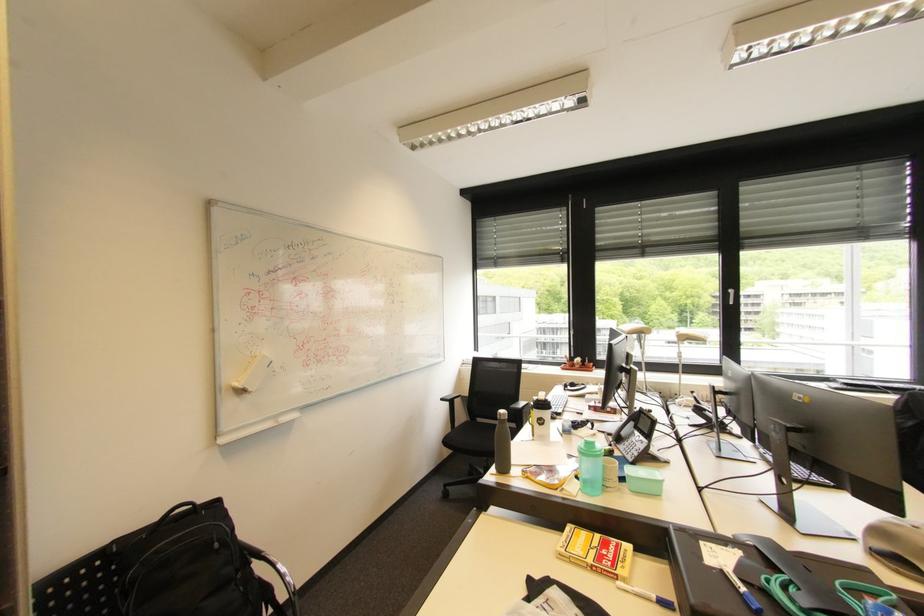
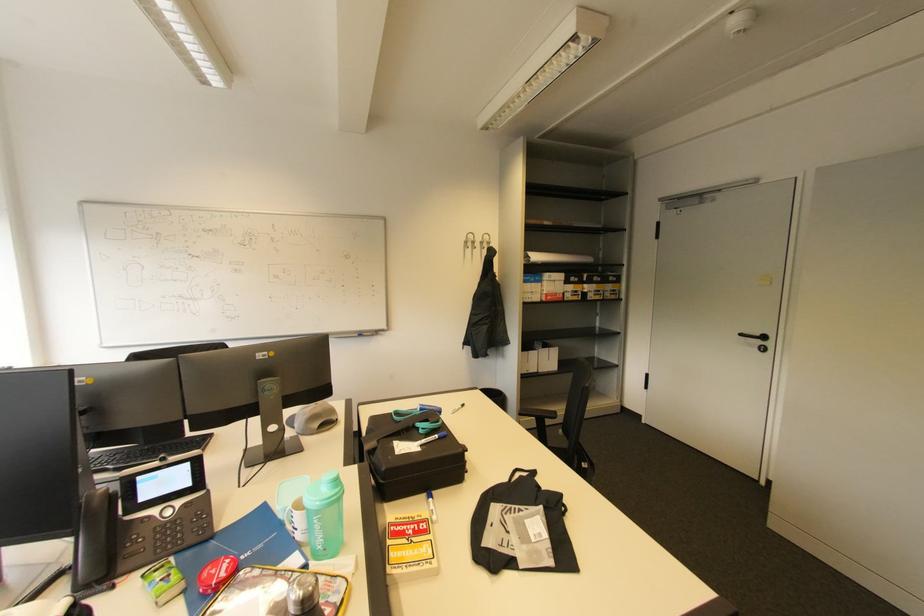
The point at [885,546] is marked in the first image. Where is the corresponding point in the second image?

(321, 426)